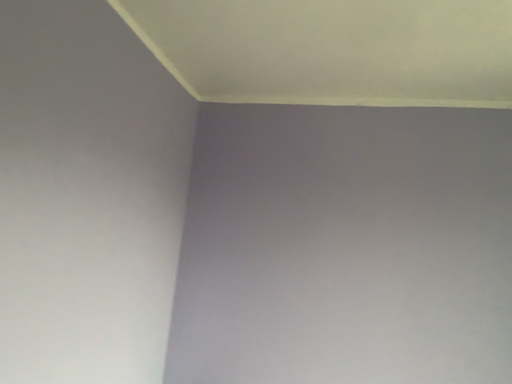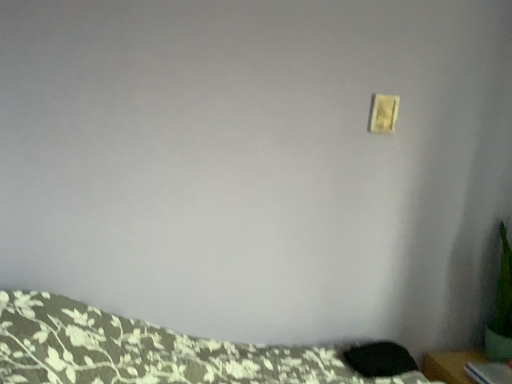
Question: Which way did the camera rotate in the video?

Choices:
 (A) rotated left
 (B) rotated right

Answer: (B)